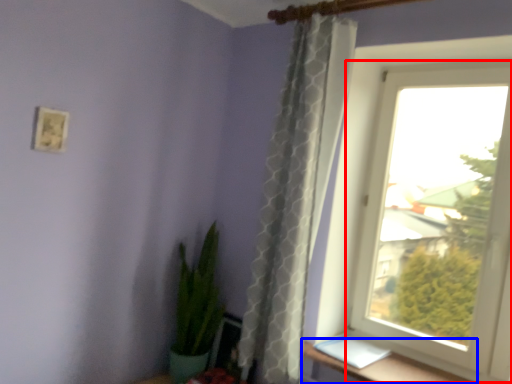
Question: Which of the following is the closest to the observer, window (highlighted by a red box) or window sill (highlighted by a blue box)?

Choices:
 (A) window
 (B) window sill

Answer: (B)